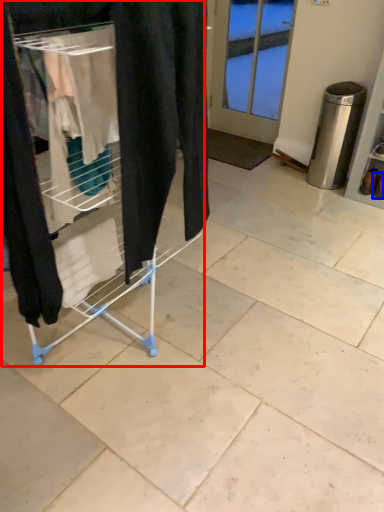
Question: Which point is further to the camera, furniture (highlighted by a red box) or footwear (highlighted by a blue box)?

Choices:
 (A) furniture
 (B) footwear

Answer: (B)